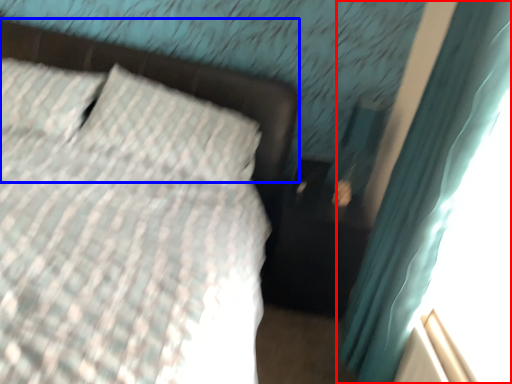
Question: Which object is further to the camera taking this photo, curtain (highlighted by a red box) or bed frame (highlighted by a blue box)?

Choices:
 (A) curtain
 (B) bed frame

Answer: (B)